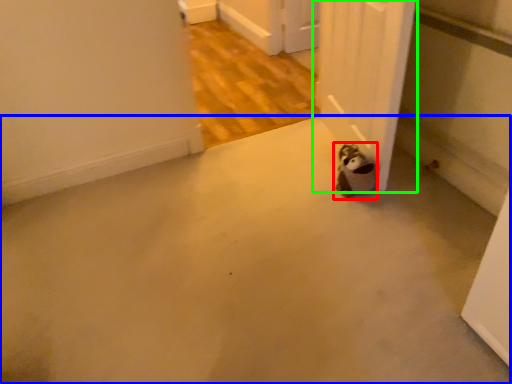
Question: Based on their relative distances, which object is nearer to animal (highlighted by a red box)? Choose from concrete (highlighted by a blue box) and door (highlighted by a green box).

Choices:
 (A) concrete
 (B) door

Answer: (B)